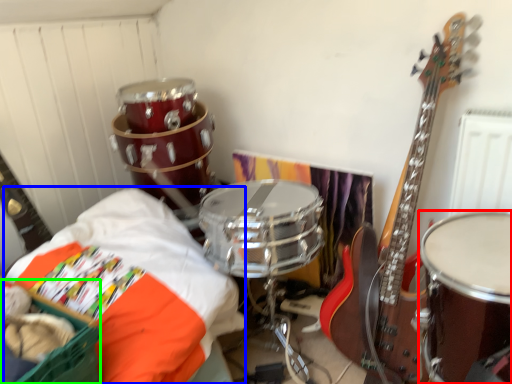
Question: Which is farther away from drum (highlighted by a red box)? sheet (highlighted by a blue box) or basket (highlighted by a green box)?

Choices:
 (A) sheet
 (B) basket

Answer: (B)